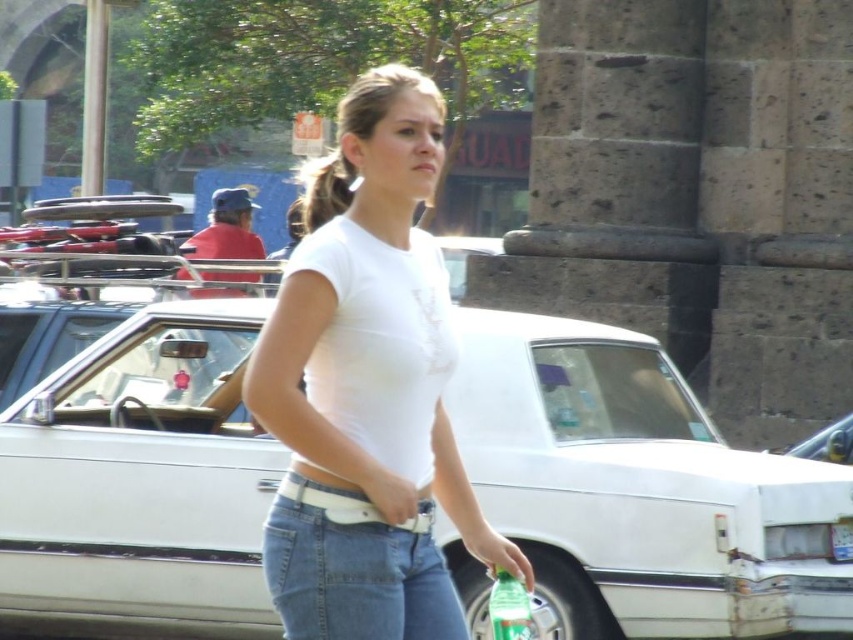
Question: Can you confirm if white matte car at center is positioned below denim jeans at center?

Choices:
 (A) yes
 (B) no

Answer: (B)

Question: Considering the real-world distances, which object is farthest from the denim jeans at center?

Choices:
 (A) blonde hair at center
 (B) white matte t-shirt at center
 (C) green matte bottle at center

Answer: (A)

Question: Does white matte car at center have a smaller size compared to denim jeans at center?

Choices:
 (A) no
 (B) yes

Answer: (A)

Question: Does denim jeans at center appear under green matte bottle at center?

Choices:
 (A) no
 (B) yes

Answer: (A)

Question: Which point is closer to the camera?

Choices:
 (A) (459, 612)
 (B) (296, 618)

Answer: (B)

Question: Which point appears closest to the camera in this image?

Choices:
 (A) (495, 600)
 (B) (637, 577)

Answer: (A)